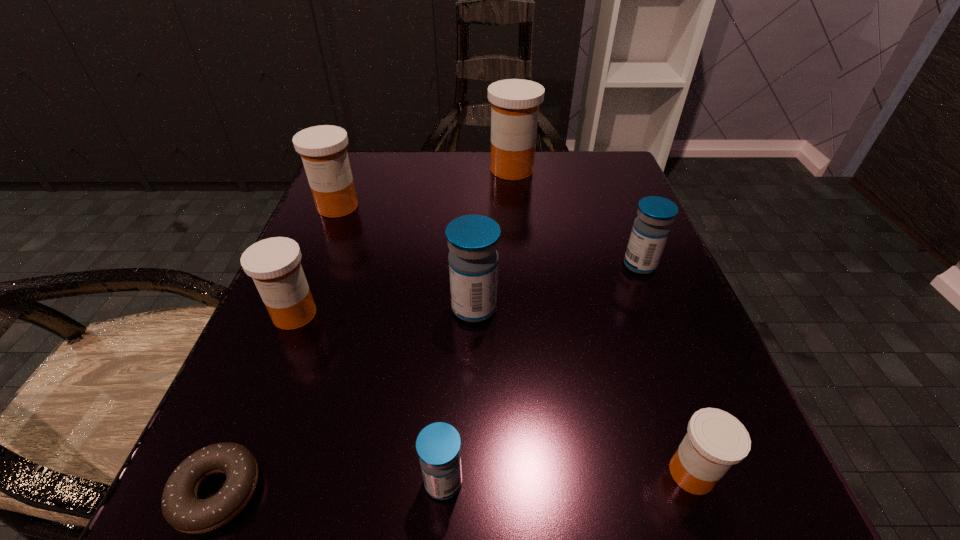
Identify which orange medicine is the nearest to the third farthest orange medicine. Please provide its 2D coordinates. Your answer should be formatted as a tuple, i.e. [(x, y)], where the tuple contains the x and y coordinates of a point satisfying the conditions above.

[(323, 150)]

Identify which orange medicine is located as the second nearest to the second smallest orange medicine. Please provide its 2D coordinates. Your answer should be formatted as a tuple, i.e. [(x, y)], where the tuple contains the x and y coordinates of a point satisfying the conditions above.

[(515, 103)]

Where is `blue medicine that can be found as the closest to the nearest orange medicine`? The image size is (960, 540). blue medicine that can be found as the closest to the nearest orange medicine is located at coordinates (438, 445).

Select which blue medicine appears as the second closest to the smallest orange medicine. Please provide its 2D coordinates. Your answer should be formatted as a tuple, i.e. [(x, y)], where the tuple contains the x and y coordinates of a point satisfying the conditions above.

[(473, 240)]

This screenshot has width=960, height=540. I want to click on free point that satisfies the following two spatial constraints: 1. on the front side of the second smallest blue medicine; 2. on the label of the rightmost orange medicine, so click(x=723, y=473).

Find the location of a particular element. vacant space that satisfies the following two spatial constraints: 1. on the label of the nearest blue medicine; 2. on the left side of the third nearest orange medicine is located at coordinates (223, 482).

Locate an element on the screen. Image resolution: width=960 pixels, height=540 pixels. vacant position in the image that satisfies the following two spatial constraints: 1. on the label of the farthest blue medicine; 2. on the left side of the seventh nearest object is located at coordinates (313, 265).

What are the coordinates of `vacant space that satisfies the following two spatial constraints: 1. on the label of the tallest object; 2. on the label of the third biggest orange medicine` in the screenshot? It's located at (527, 314).

You are a GUI agent. You are given a task and a screenshot of the screen. Output one action in this format:
    pyautogui.click(x=<x>, y=<y>)
    Task: Click on the vacant space that satisfies the following two spatial constraints: 1. on the back side of the second farthest blue medicine; 2. on the right side of the farthest blue medicine
    
    Given the screenshot: What is the action you would take?
    pyautogui.click(x=474, y=265)